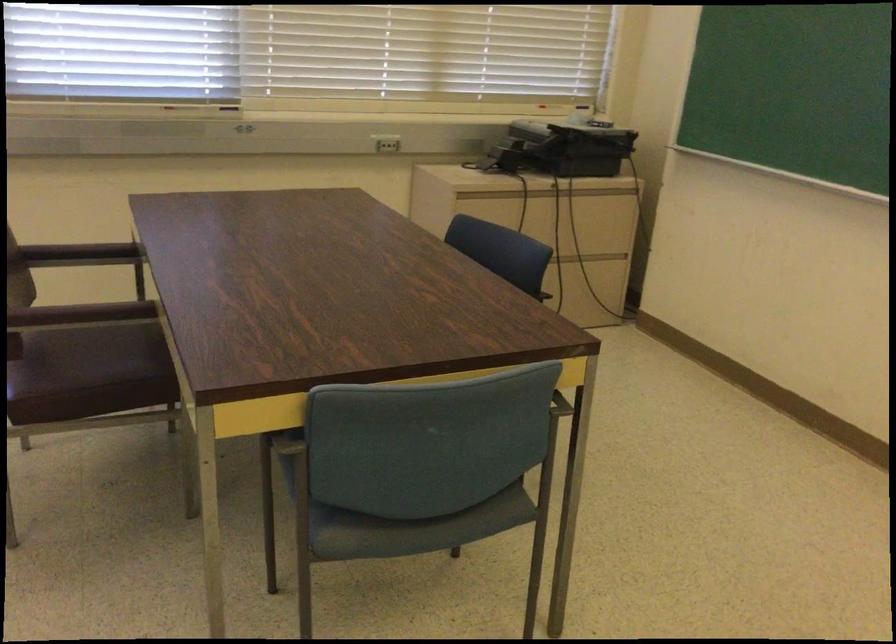
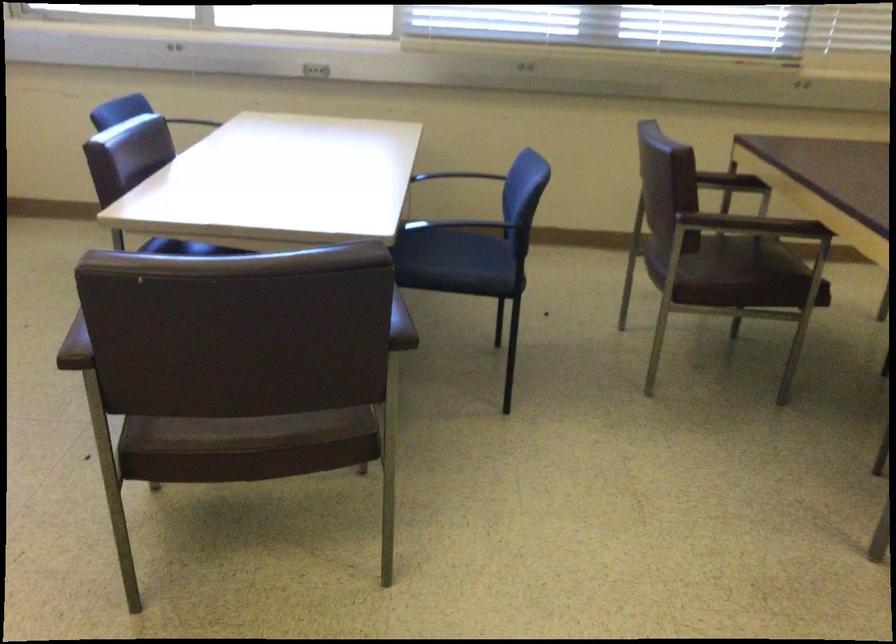
In the second image, find the point that corresponds to pixel 117 259 in the first image.

(730, 182)